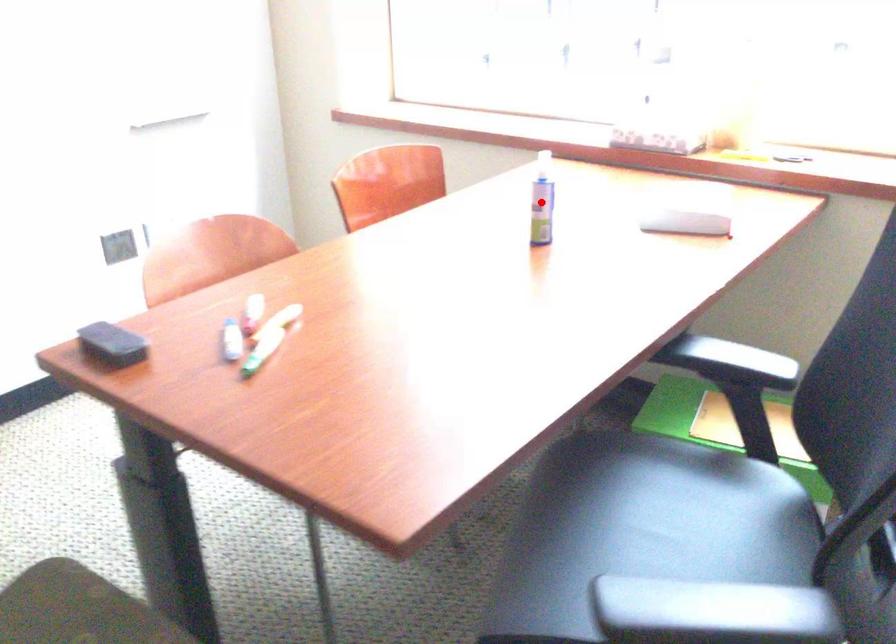
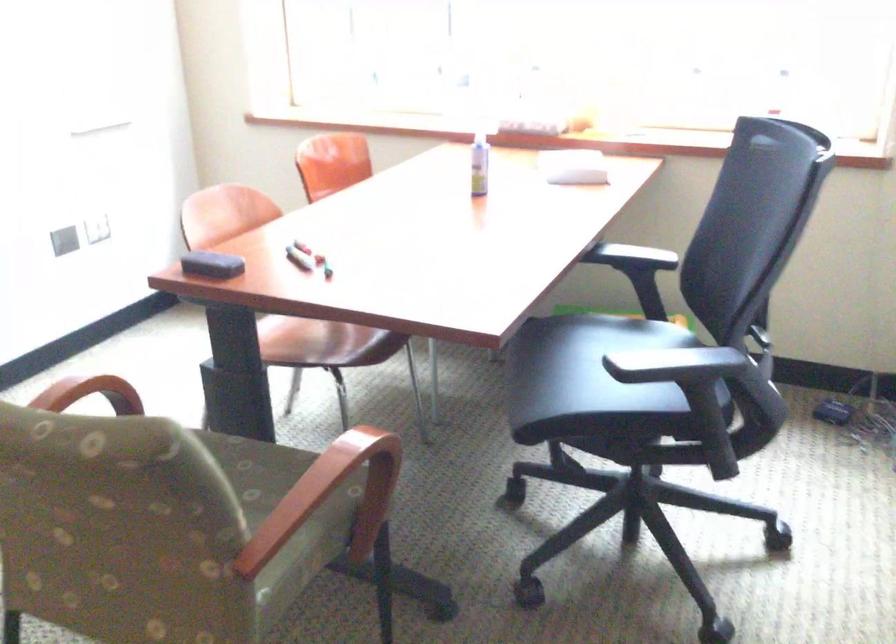
Question: I am providing you with two images of the same scene from different viewpoints. A red point is shown in image1. For the corresponding object point in image2, is it positioned nearer or farther from the camera?

Choices:
 (A) Nearer
 (B) Farther

Answer: (B)